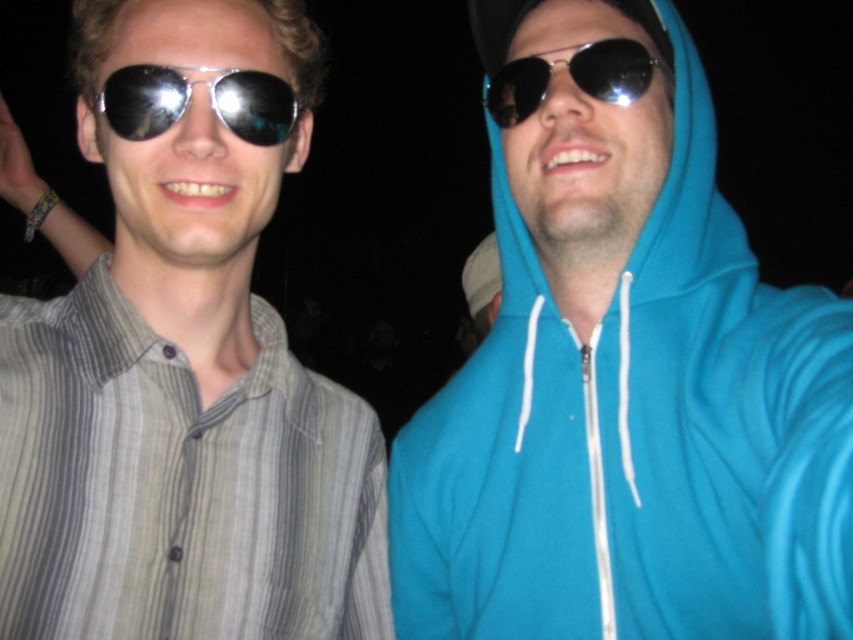
Which is behind, point (254, 136) or point (619, 64)?

Positioned behind is point (254, 136).

This screenshot has height=640, width=853. Find the location of `metallic reflective sunglasses at left`. metallic reflective sunglasses at left is located at coordinates (189, 97).

Can you confirm if striped cotton shirt at left is thinner than metallic reflective sunglasses at center?

No.

Between striped cotton shirt at left and metallic reflective sunglasses at center, which one is positioned lower?

striped cotton shirt at left is below.

Which is in front, point (167, 625) or point (556, 61)?

Point (167, 625)

In order to click on striped cotton shirt at left in this screenshot , I will do `click(184, 364)`.

Which is in front, point (189, 225) or point (171, 84)?

Point (189, 225)

Does striped cotton shirt at left have a lesser height compared to metallic reflective sunglasses at left?

Incorrect, striped cotton shirt at left's height does not fall short of metallic reflective sunglasses at left's.

Is point (152, 291) less distant than point (106, 104)?

No.

At what (x,y) coordinates should I click in order to perform the action: click on striped cotton shirt at left. Please return your answer as a coordinate pair (x, y). Looking at the image, I should click on (184, 364).